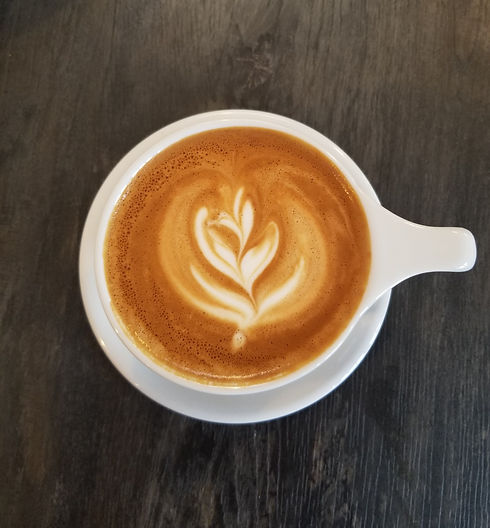
This screenshot has width=490, height=528. In order to click on handle in this screenshot , I will do `click(450, 245)`.